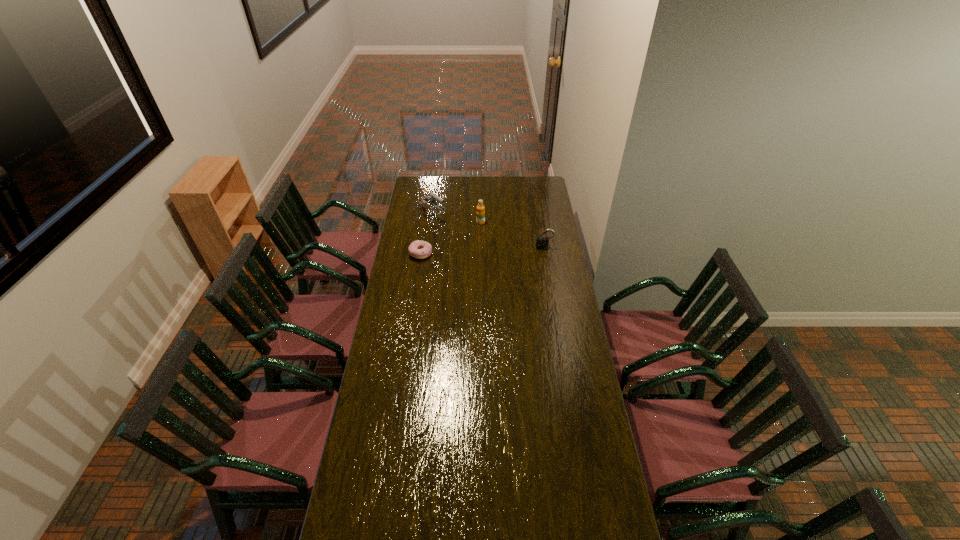
Where is `vacant space on the desktop that is between the shortest object and the second shortest object and is positioned at the barrel end of the gun`? vacant space on the desktop that is between the shortest object and the second shortest object and is positioned at the barrel end of the gun is located at coordinates (482, 251).

The image size is (960, 540). Find the location of `free space on the desktop that is between the shortest object and the rightmost object and is positioned on the label of the orange juice`. free space on the desktop that is between the shortest object and the rightmost object and is positioned on the label of the orange juice is located at coordinates (482, 251).